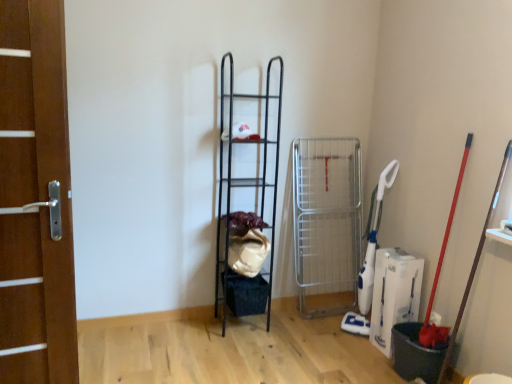
Question: Considering the positions of wooden door at left and black metal shelf at center in the image, is wooden door at left bigger or smaller than black metal shelf at center?

Choices:
 (A) big
 (B) small

Answer: (B)

Question: Relative to black metal shelf at center, is wooden door at left in front or behind?

Choices:
 (A) front
 (B) behind

Answer: (A)

Question: Considering the positions of point (11, 23) and point (219, 301), is point (11, 23) closer or farther from the camera than point (219, 301)?

Choices:
 (A) farther
 (B) closer

Answer: (B)

Question: Is black metal shelf at center wider or thinner than wooden door at left?

Choices:
 (A) thin
 (B) wide

Answer: (B)

Question: Considering the positions of black metal shelf at center and wooden door at left in the image, is black metal shelf at center bigger or smaller than wooden door at left?

Choices:
 (A) small
 (B) big

Answer: (B)

Question: From the image's perspective, is black metal shelf at center above or below wooden door at left?

Choices:
 (A) above
 (B) below

Answer: (A)

Question: Is black metal shelf at center spatially inside wooden door at left, or outside of it?

Choices:
 (A) outside
 (B) inside

Answer: (A)